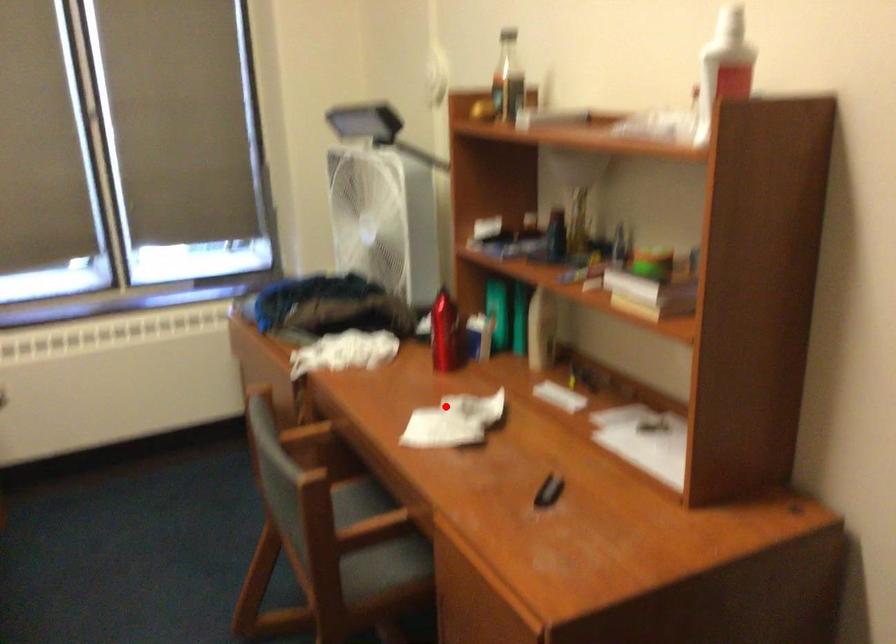
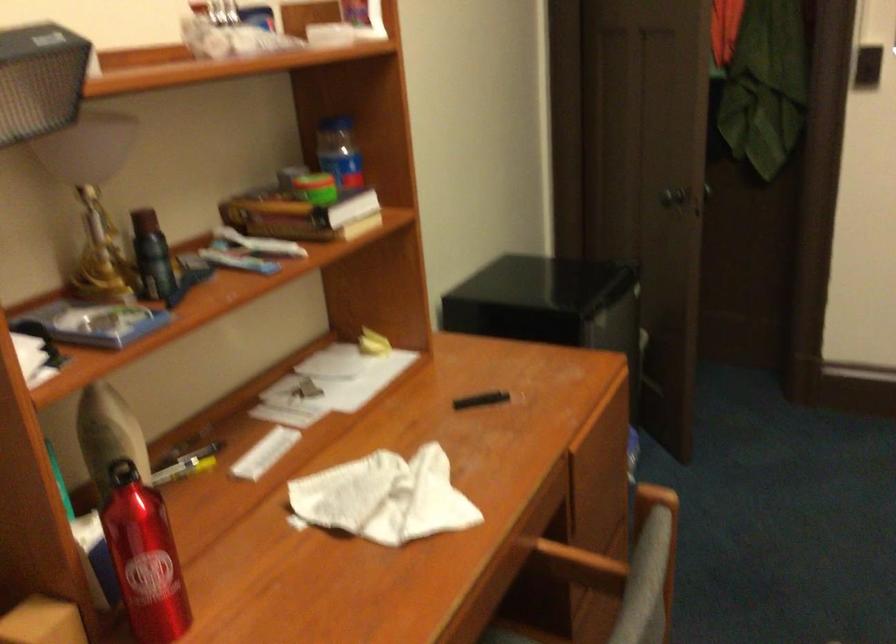
Question: A red point is marked in image1. In image2, is the corresponding 3D point closer to the camera or farther? Reply with the corresponding letter.

Choices:
 (A) The corresponding 3D point is closer.
 (B) The corresponding 3D point is farther.

Answer: (A)